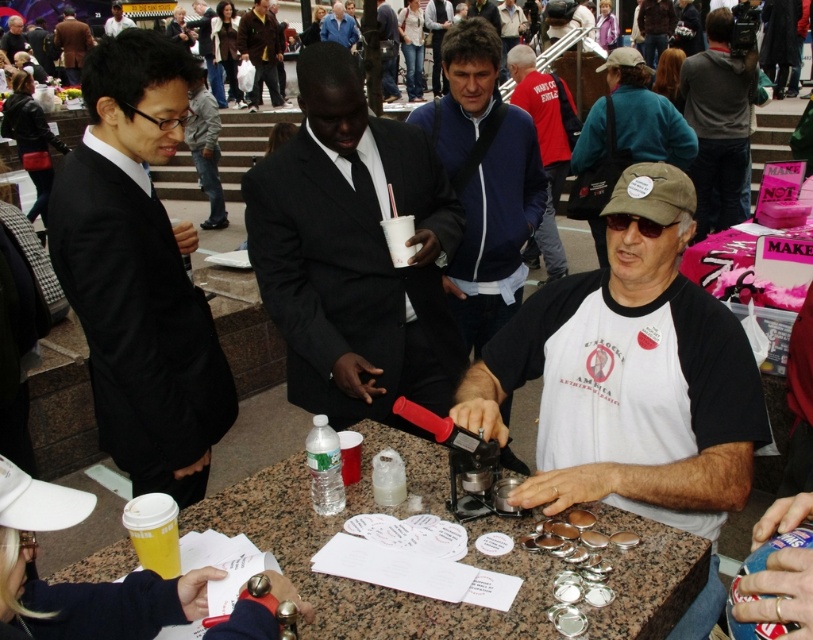
Is point (561, 326) positioned after point (218, 74)?

No, it is not.

Is white cotton t-shirt at center thinner than dark gray suit at upper center?

Yes, white cotton t-shirt at center is thinner than dark gray suit at upper center.

Does point (685, 364) come behind point (207, 13)?

No, it is in front of (207, 13).

Identify the location of white cotton t-shirt at center. (629, 374).

Which is more to the left, gray hoodie at upper right or dark gray suit at upper center?

dark gray suit at upper center is more to the left.

Does gray hoodie at upper right have a smaller size compared to dark gray suit at upper center?

Indeed, gray hoodie at upper right has a smaller size compared to dark gray suit at upper center.

Is point (712, 141) positioned after point (220, 96)?

No, it is not.

Find the location of `gray hoodie at upper right`. gray hoodie at upper right is located at coordinates (718, 124).

Can you confirm if blue fabric jacket at center is smaller than dark gray suit at upper center?

Yes, blue fabric jacket at center is smaller than dark gray suit at upper center.

Where is `blue fabric jacket at center`? The width and height of the screenshot is (813, 640). blue fabric jacket at center is located at coordinates (485, 180).